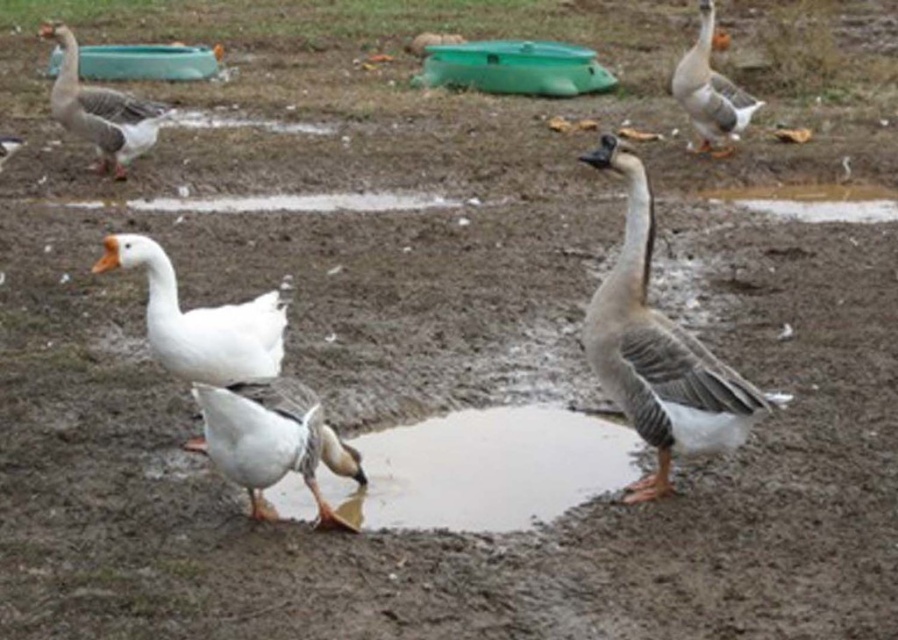
You are standing in the muddy area and want to reach the shiny mud puddle at center without getting too close. If you can only move 10 feet forward, will you be able to reach it?

The shiny mud puddle at center is 14.70 feet away from the viewer. Since you can only move 10 feet forward, you will not be able to reach it.

You are standing at the origin point of the coordinate system. You want to walk to the shiny mud puddle at center. What are the coordinates of the direction you should walk towards?

The coordinates of the shiny mud puddle at center are at point (483, 468), so you should walk towards those coordinates to reach it.